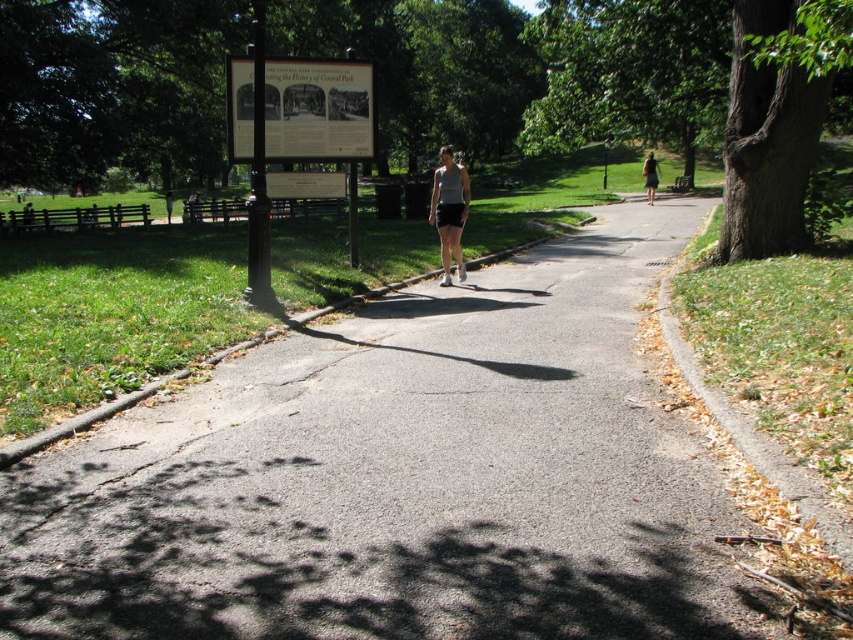
Question: Is white matte tank top at center to the right of dark green skirt at right from the viewer's perspective?

Choices:
 (A) yes
 (B) no

Answer: (B)

Question: Which of the following is the closest to the observer?

Choices:
 (A) (654, 179)
 (B) (366, 84)
 (C) (454, 204)
 (D) (769, 157)

Answer: (D)

Question: Can you confirm if wooden signboard at upper center is bigger than matte black shorts at center?

Choices:
 (A) no
 (B) yes

Answer: (A)

Question: Which point appears closest to the camera in this image?

Choices:
 (A) (836, 52)
 (B) (456, 172)

Answer: (A)

Question: Which point is closer to the camera?

Choices:
 (A) (253, 632)
 (B) (805, 92)
 (C) (467, 196)

Answer: (A)

Question: Can you confirm if asphalt path at center is bigger than white matte tank top at center?

Choices:
 (A) no
 (B) yes

Answer: (A)